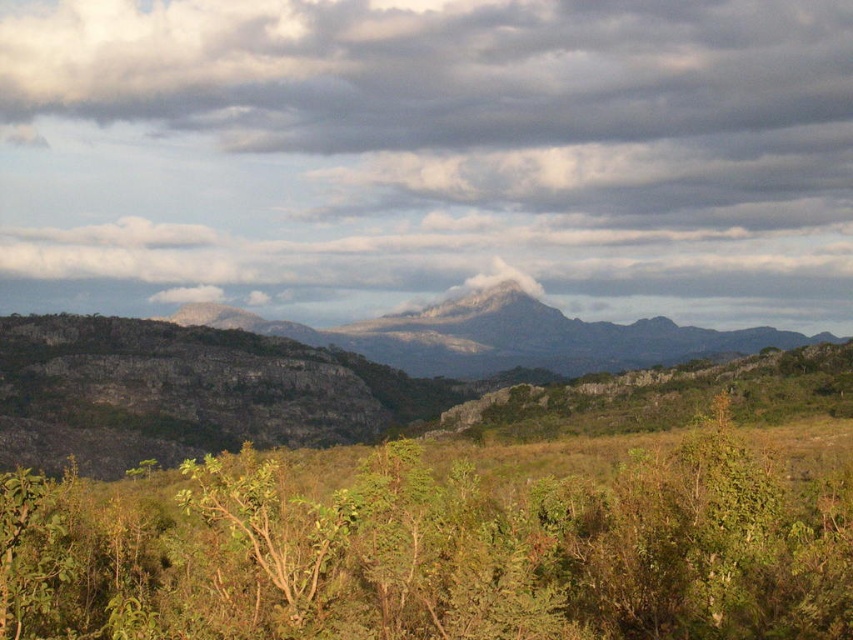
Looking at this image, you are standing at the point marked by the coordinates point (438, 550) in the image. Looking around, you see the rugged terrain and dramatic sky. What object is located at your current position?

The green leafy shrub at lower center is located at point (438, 550).

You are a hiker standing at the base of the rugged stone mountain at center. You want to reach the green leafy shrub at lower center. Given that your average hiking pace is 1.5 meters per second, how long will it take you to reach the shrub?

The green leafy shrub at lower center is 275.98 meters away from the rugged stone mountain at center. At a pace of 1.5 meters per second, it would take approximately 183.99 seconds, which is roughly 3 minutes and 3 seconds, to reach the shrub.